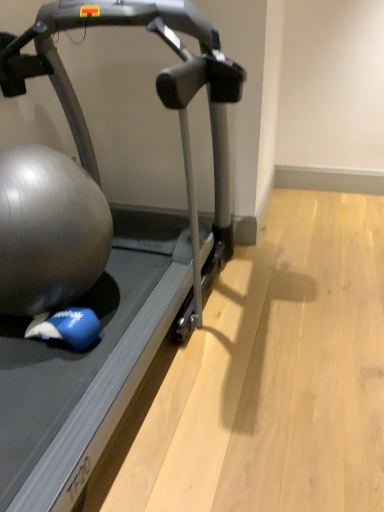
What do you see at coordinates (94, 255) in the screenshot?
I see `metallic gray treadmill at left` at bounding box center [94, 255].

At what (x,y) coordinates should I click in order to perform the action: click on metallic gray treadmill at left. Please return your answer as a coordinate pair (x, y). The image size is (384, 512). Looking at the image, I should click on (x=94, y=255).

What is the approximate height of metallic gray treadmill at left?

The height of metallic gray treadmill at left is 1.33 meters.

Locate an element on the screen. This screenshot has height=512, width=384. metallic gray treadmill at left is located at coordinates (94, 255).